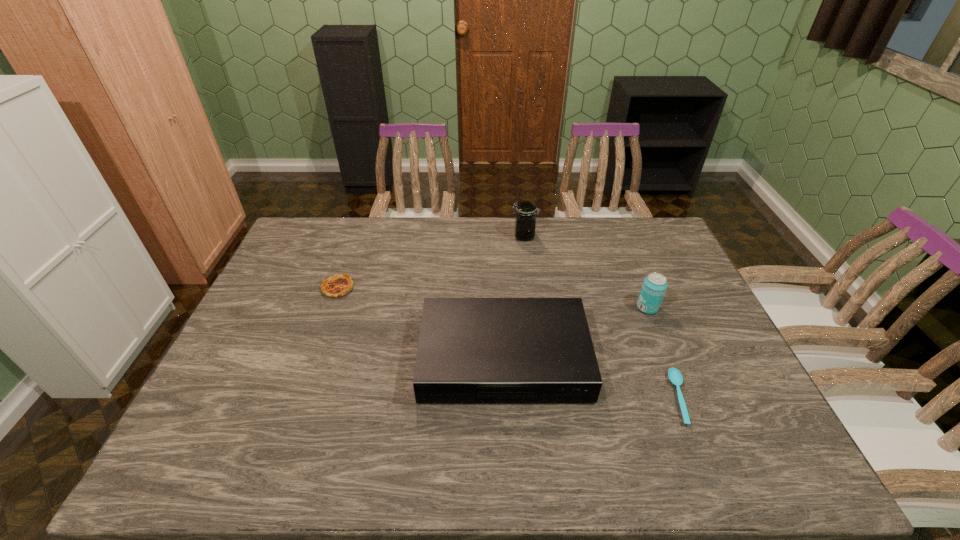
Where is `object that is the fourth closest to the jar`? The width and height of the screenshot is (960, 540). object that is the fourth closest to the jar is located at coordinates (675, 377).

Identify which object is located as the fourth nearest to the third nearest object. Please provide its 2D coordinates. Your answer should be formatted as a tuple, i.e. [(x, y)], where the tuple contains the x and y coordinates of a point satisfying the conditions above.

[(336, 286)]

The height and width of the screenshot is (540, 960). In order to click on free space that satisfies the following two spatial constraints: 1. on the front side of the fourth tallest object; 2. on the right side of the spoon in this screenshot , I will do `click(299, 397)`.

You are a GUI agent. You are given a task and a screenshot of the screen. Output one action in this format:
    pyautogui.click(x=<x>, y=<y>)
    Task: Click on the vacant space that satisfies the following two spatial constraints: 1. at the front of the spoon for disc insertion; 2. on the right side of the third tallest object
    This screenshot has width=960, height=540.
    Given the screenshot: What is the action you would take?
    pyautogui.click(x=506, y=397)

Find the location of a particular element. free space in the image that satisfies the following two spatial constraints: 1. on the lid of the jar; 2. at the front of the CD player for disc insertion is located at coordinates (540, 359).

You are a GUI agent. You are given a task and a screenshot of the screen. Output one action in this format:
    pyautogui.click(x=<x>, y=<y>)
    Task: Click on the vacant area that satisfies the following two spatial constraints: 1. at the front of the third shortest object for disc insertion; 2. on the right side of the shortest object
    Image resolution: width=960 pixels, height=540 pixels.
    Given the screenshot: What is the action you would take?
    pyautogui.click(x=506, y=397)

Where is `free spot that satisfies the following two spatial constraints: 1. on the lid of the jar; 2. at the front of the CD player for disc insertion`? This screenshot has width=960, height=540. free spot that satisfies the following two spatial constraints: 1. on the lid of the jar; 2. at the front of the CD player for disc insertion is located at coordinates (540, 359).